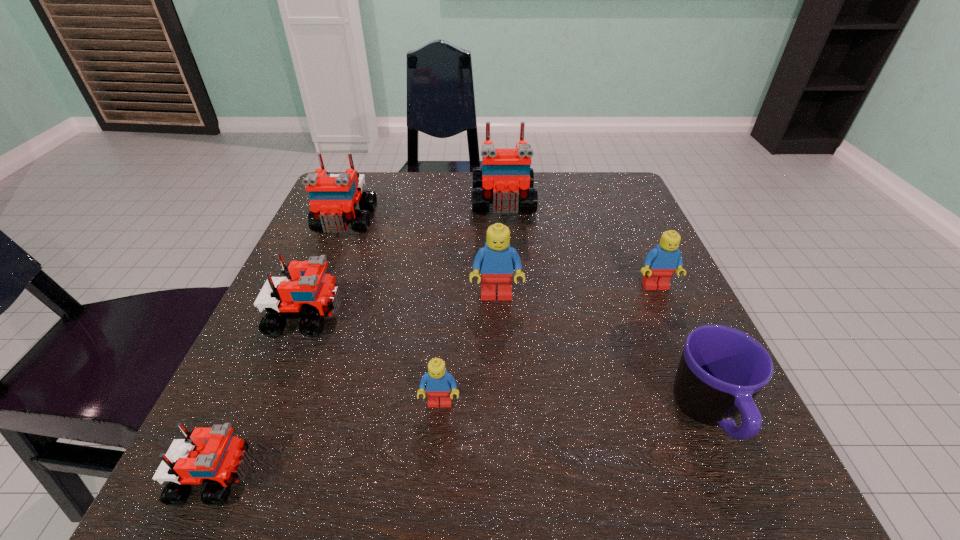
Where is `unoccupied area between the nearest Lego and the mug`? Image resolution: width=960 pixels, height=540 pixels. unoccupied area between the nearest Lego and the mug is located at coordinates (462, 446).

In order to click on object that is the fourth closest one to the nearest red Lego in this screenshot , I will do `click(334, 197)`.

Locate an element on the screen. The height and width of the screenshot is (540, 960). object that is the sixth nearest to the rightmost Lego is located at coordinates (334, 197).

This screenshot has height=540, width=960. Find the location of `Lego that stands as the fifth closest to the smallest red Lego`. Lego that stands as the fifth closest to the smallest red Lego is located at coordinates (505, 179).

This screenshot has width=960, height=540. I want to click on Lego that stands as the fourth closest to the second nearest red Lego, so click(496, 261).

Identify the location of red Lego that is the fourth closest to the second biggest blue Lego. (212, 455).

Find the location of a particular element. the third closest red Lego to the smallest blue Lego is located at coordinates (334, 197).

What are the coordinates of `the second closest blue Lego to the second biggest red Lego` in the screenshot? It's located at (438, 382).

Identify the location of blue Lego that is the second closest to the rightmost blue Lego. (438, 382).

What are the coordinates of `vacant area that satisfies the following two spatial constraints: 1. on the front-facing side of the biggest red Lego; 2. on the front-facing side of the smallest red Lego` in the screenshot? It's located at (524, 477).